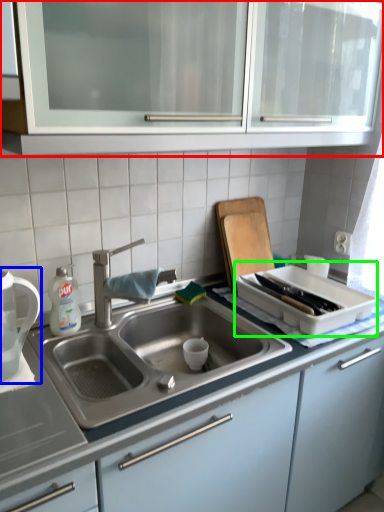
Question: Which is nearer to the cabinetry (highlighted by a red box)? tea pot (highlighted by a blue box) or appliance (highlighted by a green box).

Choices:
 (A) tea pot
 (B) appliance

Answer: (B)